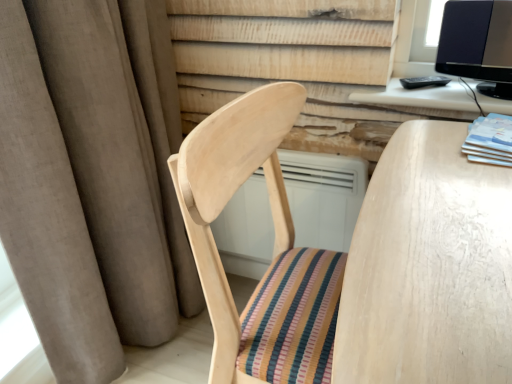
This screenshot has width=512, height=384. What do you see at coordinates (92, 179) in the screenshot?
I see `brown fabric curtain at left` at bounding box center [92, 179].

In order to face brown fabric curtain at left, should I rotate leftwards or rightwards?

Turn left by 16.924 degrees to look at brown fabric curtain at left.

The width and height of the screenshot is (512, 384). In order to click on matte blue book at right in this screenshot , I will do `click(490, 140)`.

Can you confirm if brown fabric curtain at left is taller than black glossy monitor at upper right?

Correct, brown fabric curtain at left is much taller as black glossy monitor at upper right.

Considering the relative positions of brown fabric curtain at left and black glossy monitor at upper right in the image provided, is brown fabric curtain at left in front of black glossy monitor at upper right?

Yes, brown fabric curtain at left is closer to the camera.

From a real-world perspective, between brown fabric curtain at left and black glossy monitor at upper right, who is vertically lower?

brown fabric curtain at left.

Consider the image. Can you confirm if brown fabric curtain at left is positioned to the left of black glossy monitor at upper right?

Yes.

Is point (507, 89) farther from camera compared to point (77, 212)?

That is True.

Can you tell me how much black glossy monitor at upper right and brown fabric curtain at left differ in facing direction?

They differ by 82.2 degrees in their facing directions.

Is black glossy monitor at upper right positioned with its back to brown fabric curtain at left?

No, brown fabric curtain at left is not at the back of black glossy monitor at upper right.

Considering the relative positions of black glossy monitor at upper right and brown fabric curtain at left in the image provided, is black glossy monitor at upper right behind brown fabric curtain at left?

Yes, it is behind brown fabric curtain at left.

Is black glossy monitor at upper right looking in the opposite direction of white wood computer desk at upper right?

No, black glossy monitor at upper right is not facing away from white wood computer desk at upper right.

Could white wood computer desk at upper right be considered to be inside black glossy monitor at upper right?

Actually, white wood computer desk at upper right is outside black glossy monitor at upper right.

Is black glossy monitor at upper right positioned behind white wood computer desk at upper right?

No, black glossy monitor at upper right is closer to the camera.

Based on their positions, is black glossy monitor at upper right located to the left or right of white wood computer desk at upper right?

→ black glossy monitor at upper right is positioned on white wood computer desk at upper right's right side.

Does brown fabric curtain at left have a lesser width compared to white wood computer desk at upper right?

In fact, brown fabric curtain at left might be wider than white wood computer desk at upper right.

From a real-world perspective, does brown fabric curtain at left sit lower than white wood computer desk at upper right?

Yes, from a real-world perspective, brown fabric curtain at left is beneath white wood computer desk at upper right.

What are the coordinates of `computer desk that appears on the right of brown fabric curtain at left` in the screenshot? It's located at (424, 99).

In terms of height, does brown fabric curtain at left look taller or shorter compared to white wood computer desk at upper right?

Clearly, brown fabric curtain at left is taller compared to white wood computer desk at upper right.

Based on their positions, is brown fabric curtain at left located to the left or right of matte blue book at right?

brown fabric curtain at left is positioned on matte blue book at right's left side.

Is brown fabric curtain at left thinner than matte blue book at right?

Incorrect, the width of brown fabric curtain at left is not less than that of matte blue book at right.

Is brown fabric curtain at left oriented away from matte blue book at right?

No, brown fabric curtain at left is not facing the opposite direction of matte blue book at right.

Between point (32, 101) and point (495, 149), which one is positioned behind?

The point (32, 101) is farther from the camera.

Is matte blue book at right wider or thinner than white wood computer desk at upper right?

Clearly, matte blue book at right has more width compared to white wood computer desk at upper right.

From the picture: Is matte blue book at right turned away from white wood computer desk at upper right?

No, white wood computer desk at upper right is not at the back of matte blue book at right.

Visually, is matte blue book at right positioned to the left or to the right of white wood computer desk at upper right?

Based on their positions, matte blue book at right is located to the right of white wood computer desk at upper right.

Which point is more forward, (503, 118) or (464, 105)?

The point (503, 118) is closer.

What's the angular difference between white wood computer desk at upper right and matte blue book at right's facing directions?

The facing directions of white wood computer desk at upper right and matte blue book at right are 6.28 degrees apart.

Is white wood computer desk at upper right facing away from matte blue book at right?

No, white wood computer desk at upper right is not facing the opposite direction of matte blue book at right.

Which is in front, white wood computer desk at upper right or matte blue book at right?

matte blue book at right is closer to the camera.

Looking at the image, does white wood computer desk at upper right seem bigger or smaller compared to matte blue book at right?

In the image, white wood computer desk at upper right appears to be larger than matte blue book at right.

I want to click on computer monitor on the right of brown fabric curtain at left, so click(x=478, y=43).

This screenshot has width=512, height=384. Find the location of `curtain located below the black glossy monitor at upper right (from the image's perspective)`. curtain located below the black glossy monitor at upper right (from the image's perspective) is located at coordinates (92, 179).

Looking at the image, which one is located further to brown fabric curtain at left, black glossy monitor at upper right or white wood computer desk at upper right?

black glossy monitor at upper right is positioned further to the anchor brown fabric curtain at left.

Looking at the image, which one is located closer to white wood computer desk at upper right, black glossy monitor at upper right or brown fabric curtain at left?

black glossy monitor at upper right is positioned closer to the anchor white wood computer desk at upper right.

Considering their positions, is black glossy monitor at upper right positioned further to white wood computer desk at upper right than matte blue book at right?

The object further to white wood computer desk at upper right is matte blue book at right.

Estimate the real-world distances between objects in this image. Which object is closer to matte blue book at right, brown fabric curtain at left or white wood computer desk at upper right?

white wood computer desk at upper right.

When comparing their distances from brown fabric curtain at left, does matte blue book at right or white wood computer desk at upper right seem closer?

white wood computer desk at upper right.

Consider the image. When comparing their distances from matte blue book at right, does black glossy monitor at upper right or brown fabric curtain at left seem closer?

Among the two, black glossy monitor at upper right is located nearer to matte blue book at right.

Looking at the image, which one is located closer to matte blue book at right, white wood computer desk at upper right or black glossy monitor at upper right?

The object closer to matte blue book at right is white wood computer desk at upper right.

From the image, which object appears to be farther from black glossy monitor at upper right, matte blue book at right or brown fabric curtain at left?

brown fabric curtain at left is positioned further to the anchor black glossy monitor at upper right.

Identify the location of computer monitor between brown fabric curtain at left and matte blue book at right. (478, 43).

Locate an element on the screen. computer desk located between brown fabric curtain at left and black glossy monitor at upper right in the left-right direction is located at coordinates (424, 99).

You are a GUI agent. You are given a task and a screenshot of the screen. Output one action in this format:
    pyautogui.click(x=<x>, y=<y>)
    Task: Click on the computer desk situated between brown fabric curtain at left and matte blue book at right from left to right
    
    Given the screenshot: What is the action you would take?
    pyautogui.click(x=424, y=99)

Find the location of `computer monitor between matte blue book at right and white wood computer desk at upper right along the z-axis`. computer monitor between matte blue book at right and white wood computer desk at upper right along the z-axis is located at coordinates (478, 43).